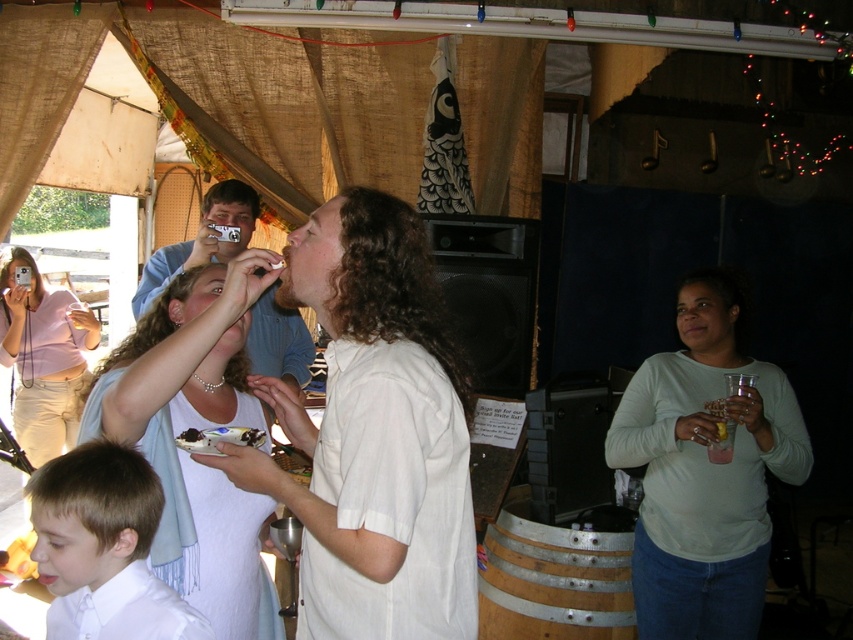
Question: Does white fabric scarf at upper left lie behind white smooth shirt at lower left?

Choices:
 (A) no
 (B) yes

Answer: (B)

Question: Which point is closer to the camera taking this photo?

Choices:
 (A) (206, 420)
 (B) (148, 636)
 (C) (572, 580)
 (D) (717, 508)

Answer: (B)

Question: Which is nearer to the wooden barrel at lower center?

Choices:
 (A) white smooth shirt at lower left
 (B) matte pink shirt at upper left

Answer: (A)

Question: Can you confirm if white smooth shirt at lower left is positioned below matte pink shirt at upper left?

Choices:
 (A) no
 (B) yes

Answer: (B)

Question: Which of these objects is positioned farthest from the wooden barrel at lower center?

Choices:
 (A) white smooth shirt at lower left
 (B) white fabric scarf at upper left

Answer: (A)

Question: Does light green long-sleeve shirt at center-right appear under white fabric scarf at upper left?

Choices:
 (A) yes
 (B) no

Answer: (A)